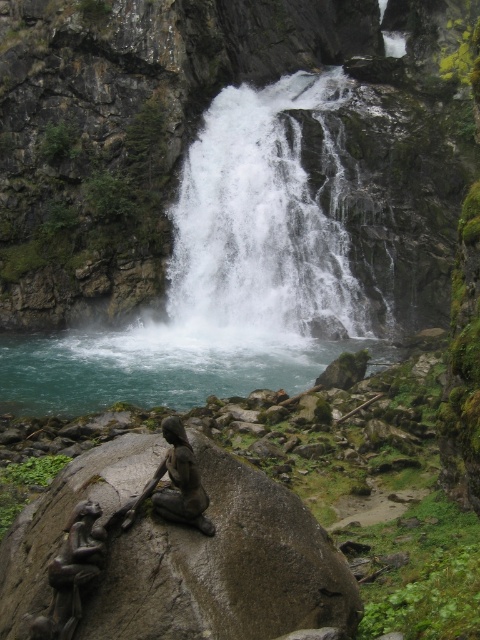
Question: Which point is closer to the camera taking this photo?

Choices:
 (A) (215, 502)
 (B) (60, 554)
 (C) (301, 358)
 (D) (175, 317)

Answer: (B)

Question: Among these points, which one is farthest from the camera?

Choices:
 (A) (242, 502)
 (B) (178, 420)
 (C) (36, 376)
 (D) (69, 636)

Answer: (C)

Question: Is smooth gray rock at center positioned behind white frothy water at center?

Choices:
 (A) yes
 (B) no

Answer: (B)

Question: Can you confirm if smooth gray rock at center is thinner than teal smooth water at center?

Choices:
 (A) yes
 (B) no

Answer: (A)

Question: Which of the following is the closest to the observer?

Choices:
 (A) (336, 182)
 (B) (264, 340)

Answer: (B)

Question: Where is teal smooth water at center located in relation to bronze statue at center in the image?

Choices:
 (A) right
 (B) left

Answer: (B)